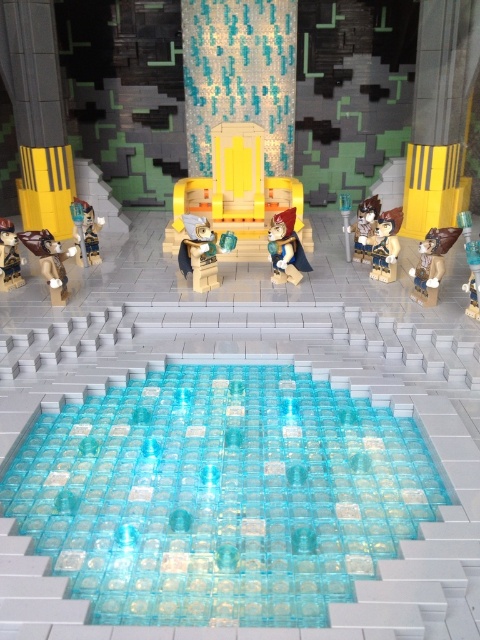
You are a visitor standing in the grand hall and want to approach the throne. As you look towards the throne, which object is closer to you between the yellow matte pillar at right and the matte brown minifigure at lower left?

The yellow matte pillar at right is positioned over the matte brown minifigure at lower left, so the yellow matte pillar at right is closer to you.

You are a character in the LEGO diorama needing to retrieve the translucent plastic sword at center. The throne is in your way. Can you step onto the translucent blue tiles at center to reach the sword?

The translucent blue tiles at center are located below the translucent plastic sword at center, so you can step onto them to reach the sword.